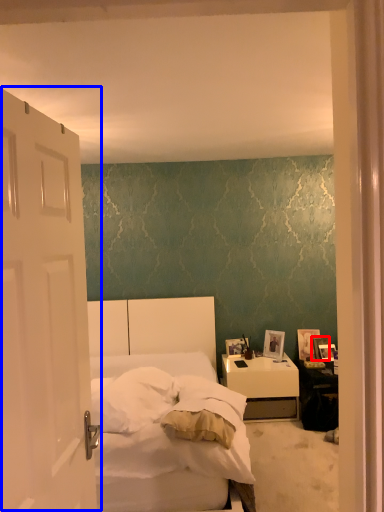
Question: Which object is further to the camera taking this photo, picture frame (highlighted by a red box) or door (highlighted by a blue box)?

Choices:
 (A) picture frame
 (B) door

Answer: (A)